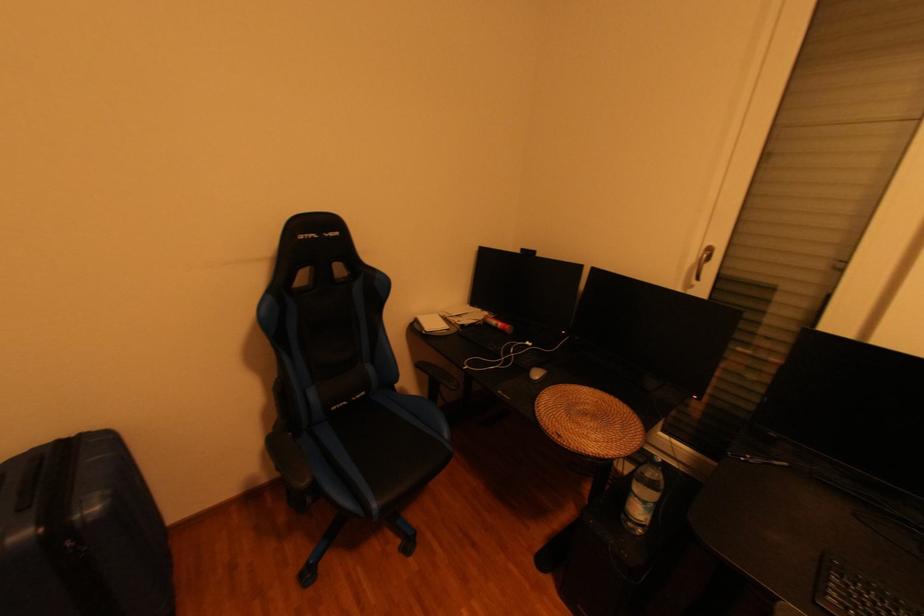
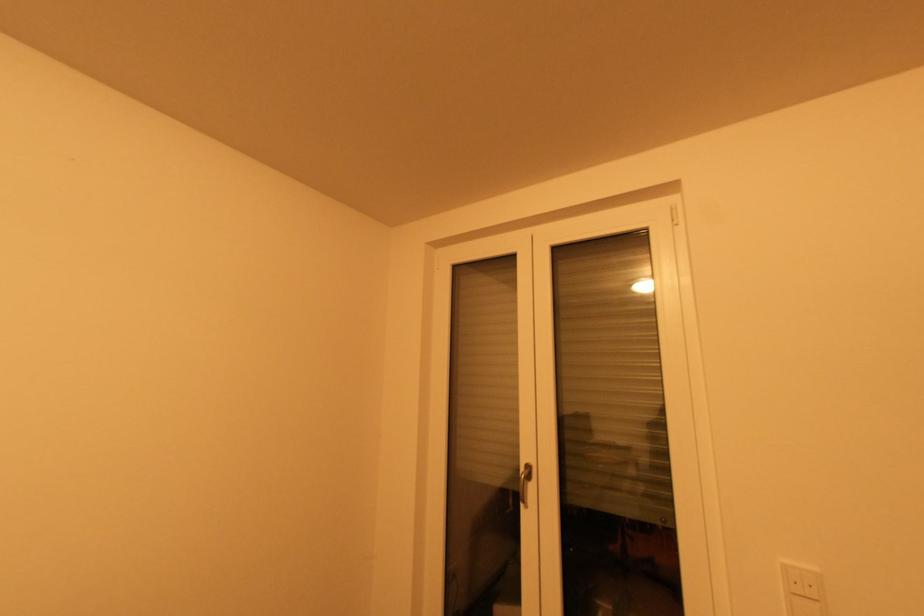
Question: Based on the continuous images, in which direction is the camera rotating? Reply with the corresponding letter.

Choices:
 (A) Left
 (B) Right
 (C) Up
 (D) Down

Answer: (B)